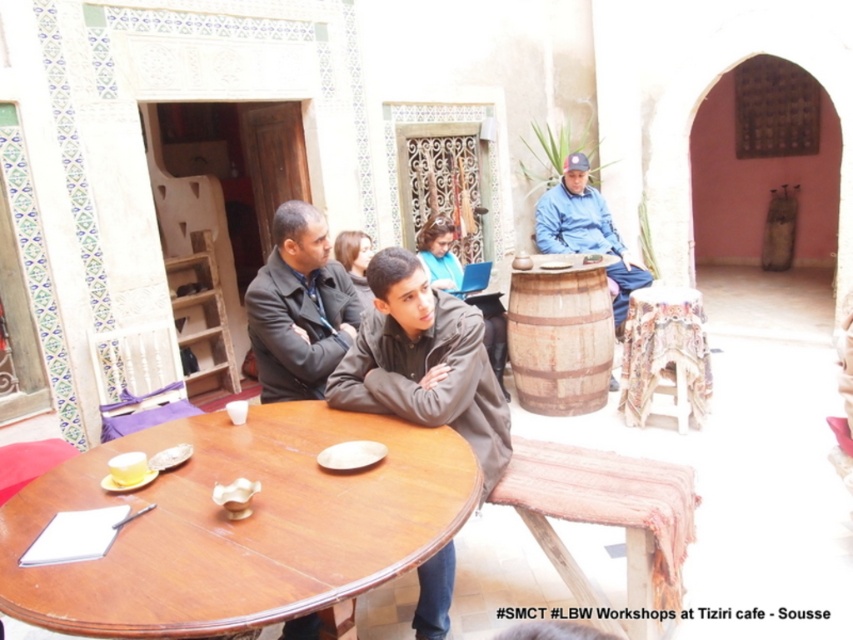
From the picture: Is dark gray suit at center to the right of blue denim jacket at center from the viewer's perspective?

In fact, dark gray suit at center is to the left of blue denim jacket at center.

Is dark gray suit at center to the left of blue denim jacket at center from the viewer's perspective?

Indeed, dark gray suit at center is positioned on the left side of blue denim jacket at center.

Who is more distant from viewer, (274, 365) or (608, 268)?

Point (608, 268)

Identify the location of dark gray suit at center. The width and height of the screenshot is (853, 640). (299, 307).

Can you confirm if dark gray suit at center is positioned below wooden barrel at center?

No.

Who is positioned more to the left, dark gray suit at center or wooden barrel at center?

From the viewer's perspective, dark gray suit at center appears more on the left side.

Is point (299, 308) farther from viewer compared to point (544, 289)?

No, (299, 308) is in front of (544, 289).

I want to click on dark gray suit at center, so click(299, 307).

Is point (677, 364) closer to viewer compared to point (614, 308)?

That is True.

Is point (689, 374) closer to camera compared to point (610, 214)?

Yes.

Locate an element on the screen. This screenshot has width=853, height=640. patterned fabric table at center is located at coordinates (665, 355).